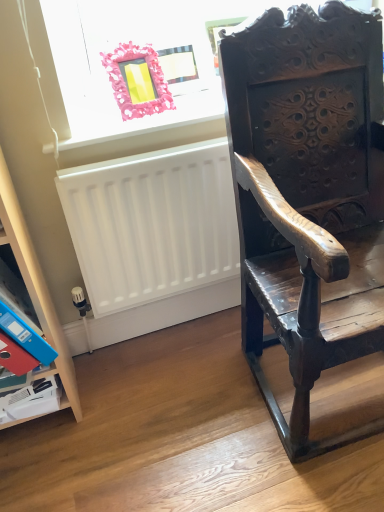
The width and height of the screenshot is (384, 512). In order to click on free point above pink plastic frame at upper left (from a real-world perspective) in this screenshot , I will do (120, 116).